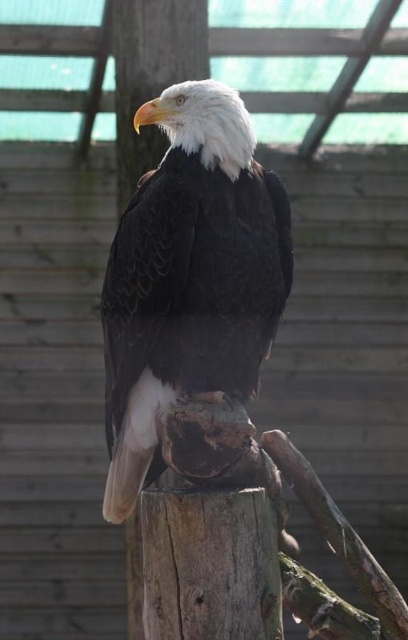
Question: Is white-feathered eagle at center above brown rough wood at center?

Choices:
 (A) no
 (B) yes

Answer: (A)

Question: Considering the relative positions of white-feathered eagle at center and brown rough wood at center in the image provided, where is white-feathered eagle at center located with respect to brown rough wood at center?

Choices:
 (A) above
 (B) below

Answer: (B)

Question: Which point appears farthest from the camera in this image?

Choices:
 (A) (124, 1)
 (B) (243, 250)

Answer: (A)

Question: Is white-feathered eagle at center closer to camera compared to brown rough wood at center?

Choices:
 (A) no
 (B) yes

Answer: (B)